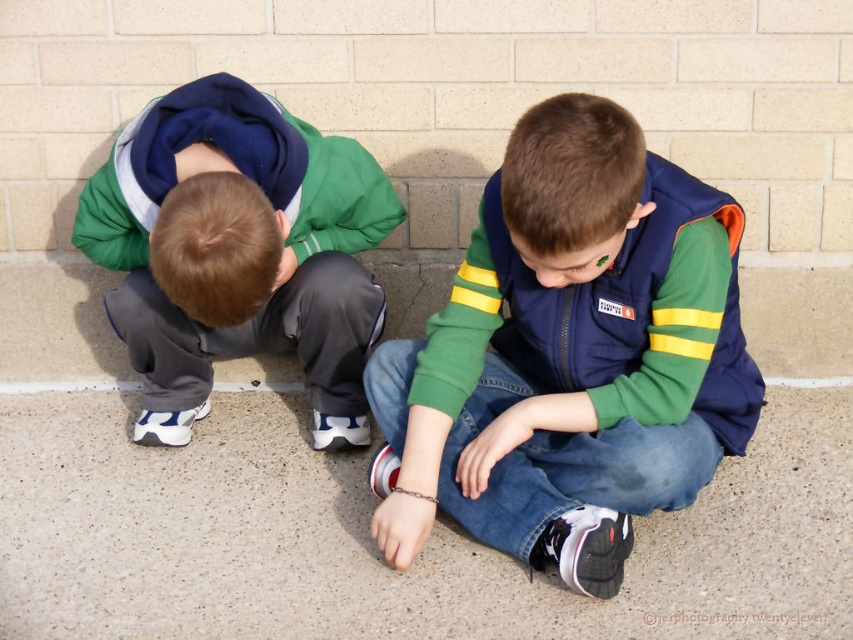
Question: Estimate the real-world distances between objects in this image. Which object is farther from the smooth concrete pavement at lower center?

Choices:
 (A) gray fleece pants at lower left
 (B) navy blue jacket at center

Answer: (A)

Question: Does navy blue jacket at center have a smaller size compared to gray fleece pants at lower left?

Choices:
 (A) yes
 (B) no

Answer: (A)

Question: Does smooth concrete pavement at lower center appear on the right side of navy blue jacket at center?

Choices:
 (A) no
 (B) yes

Answer: (A)

Question: Is navy blue jacket at center to the left of gray fleece pants at lower left from the viewer's perspective?

Choices:
 (A) yes
 (B) no

Answer: (B)

Question: Which object is the farthest from the gray fleece pants at lower left?

Choices:
 (A) smooth concrete pavement at lower center
 (B) navy blue jacket at center

Answer: (B)

Question: Estimate the real-world distances between objects in this image. Which object is farther from the smooth concrete pavement at lower center?

Choices:
 (A) gray fleece pants at lower left
 (B) navy blue jacket at center

Answer: (A)